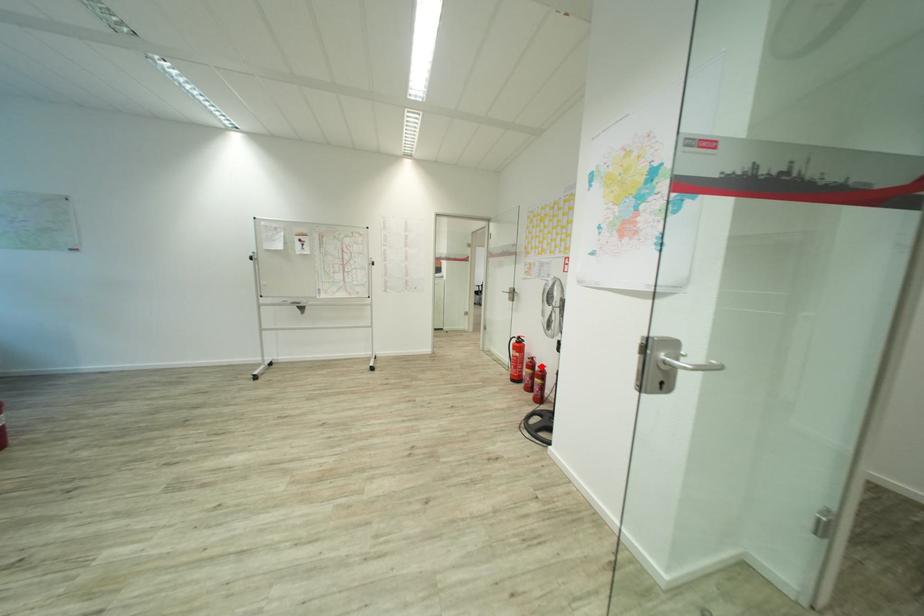
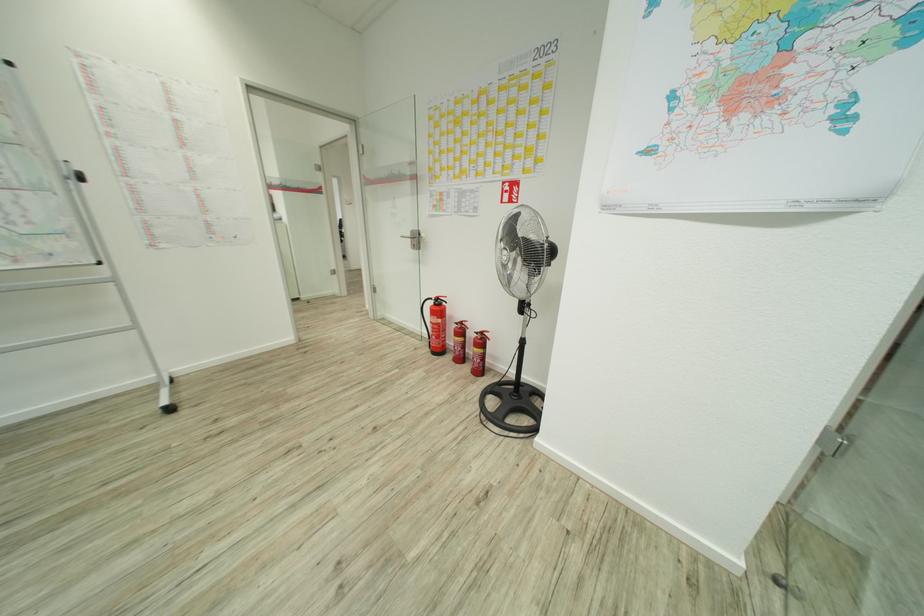
Where in the second image is the point corresponding to the highlighted location from the first image?

(480, 331)